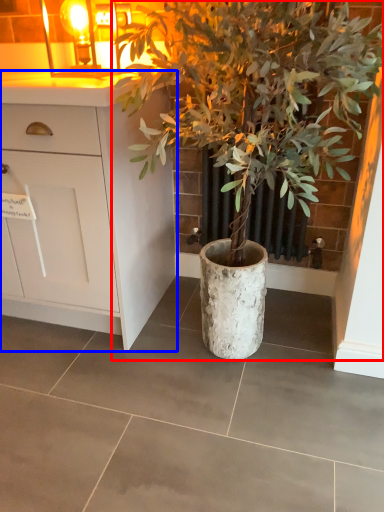
Question: Which object is closer to the camera taking this photo, houseplant (highlighted by a red box) or cabinetry (highlighted by a blue box)?

Choices:
 (A) houseplant
 (B) cabinetry

Answer: (A)